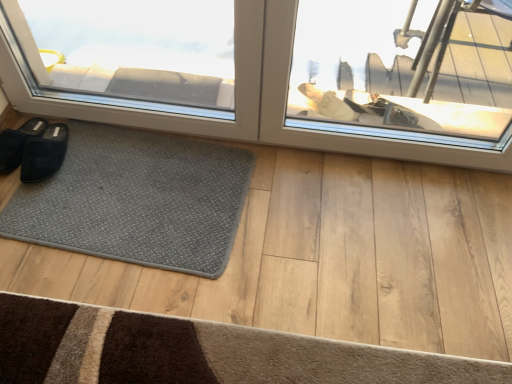
Locate an element on the screen. The height and width of the screenshot is (384, 512). free space above gray textured mat at lower left (from a real-world perspective) is located at coordinates (131, 186).